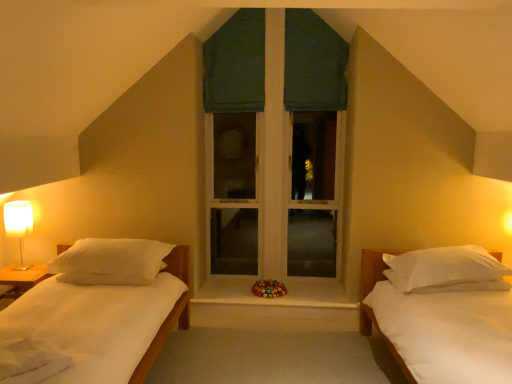
Question: Which direction should I rotate to look at green fabric curtain at upper center, which is the 2th curtain in left-to-right order?

Choices:
 (A) left
 (B) right

Answer: (B)

Question: Could green fabric window at center be considered to be inside dark green fabric at center, acting as the 2th curtain starting from the right?

Choices:
 (A) yes
 (B) no

Answer: (B)

Question: Can you confirm if dark green fabric at center, the first curtain positioned from the left, is thinner than green fabric window at center?

Choices:
 (A) yes
 (B) no

Answer: (A)

Question: Is green fabric window at center at the back of dark green fabric at center, acting as the 2th curtain starting from the right?

Choices:
 (A) no
 (B) yes

Answer: (B)

Question: Does dark green fabric at center, the first curtain positioned from the left, have a smaller size compared to green fabric window at center?

Choices:
 (A) yes
 (B) no

Answer: (A)

Question: Could you tell me if dark green fabric at center, acting as the 2th curtain starting from the right, is facing green fabric window at center?

Choices:
 (A) no
 (B) yes

Answer: (B)

Question: From the image's perspective, does dark green fabric at center, the first curtain positioned from the left, appear lower than green fabric window at center?

Choices:
 (A) yes
 (B) no

Answer: (B)

Question: Is white fabric-covered lamp at left surrounding green fabric window at center?

Choices:
 (A) no
 (B) yes

Answer: (A)

Question: Is white fabric-covered lamp at left to the right of green fabric window at center from the viewer's perspective?

Choices:
 (A) yes
 (B) no

Answer: (B)

Question: Can you confirm if white fabric-covered lamp at left is smaller than green fabric window at center?

Choices:
 (A) yes
 (B) no

Answer: (A)

Question: Does white fabric-covered lamp at left have a lesser width compared to green fabric window at center?

Choices:
 (A) yes
 (B) no

Answer: (A)

Question: Is white fabric-covered lamp at left bigger than green fabric window at center?

Choices:
 (A) no
 (B) yes

Answer: (A)

Question: From the image's perspective, is white fabric-covered lamp at left beneath green fabric window at center?

Choices:
 (A) yes
 (B) no

Answer: (A)

Question: Is the depth of white soft pillow at left, which appears as the 2th pillow when viewed from the right, less than that of wooden at center?

Choices:
 (A) yes
 (B) no

Answer: (A)